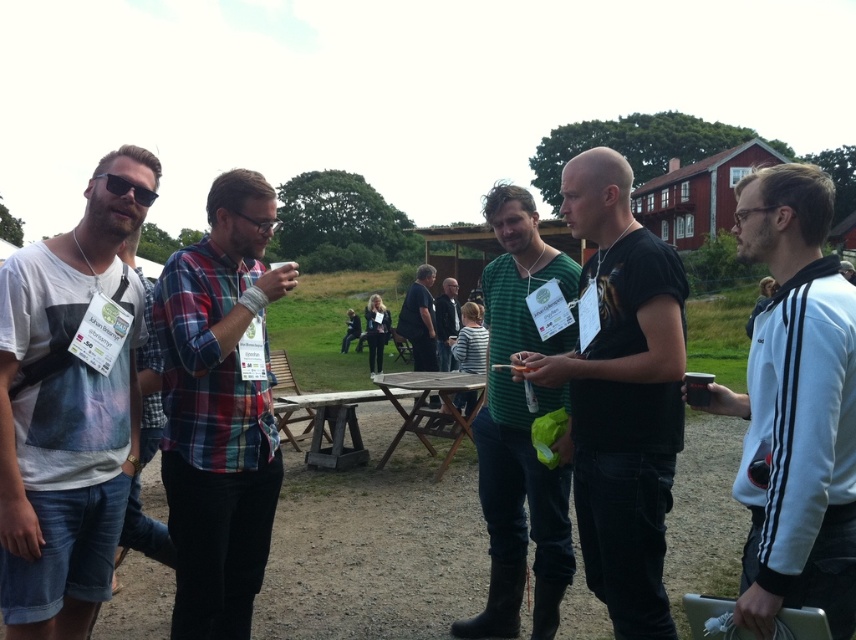
Between white fleece jacket at right and plaid fabric shirt at center, which one has more height?

plaid fabric shirt at center

Identify the location of white fleece jacket at right. The image size is (856, 640). (794, 406).

Does white fleece jacket at right have a lesser height compared to wooden picnic table at center?

In fact, white fleece jacket at right may be taller than wooden picnic table at center.

Is white fleece jacket at right taller than wooden picnic table at center?

Indeed, white fleece jacket at right has a greater height compared to wooden picnic table at center.

Between point (774, 589) and point (437, 376), which one is positioned in front?

Point (774, 589)

The height and width of the screenshot is (640, 856). Identify the location of white fleece jacket at right. (794, 406).

Does green striped shirt at center have a larger size compared to matte black sunglasses at left?

Yes, green striped shirt at center is bigger than matte black sunglasses at left.

Can you confirm if green striped shirt at center is thinner than matte black sunglasses at left?

No.

Identify the location of green striped shirt at center. Image resolution: width=856 pixels, height=640 pixels. (520, 429).

Where is `green striped shirt at center`? green striped shirt at center is located at coordinates (520, 429).